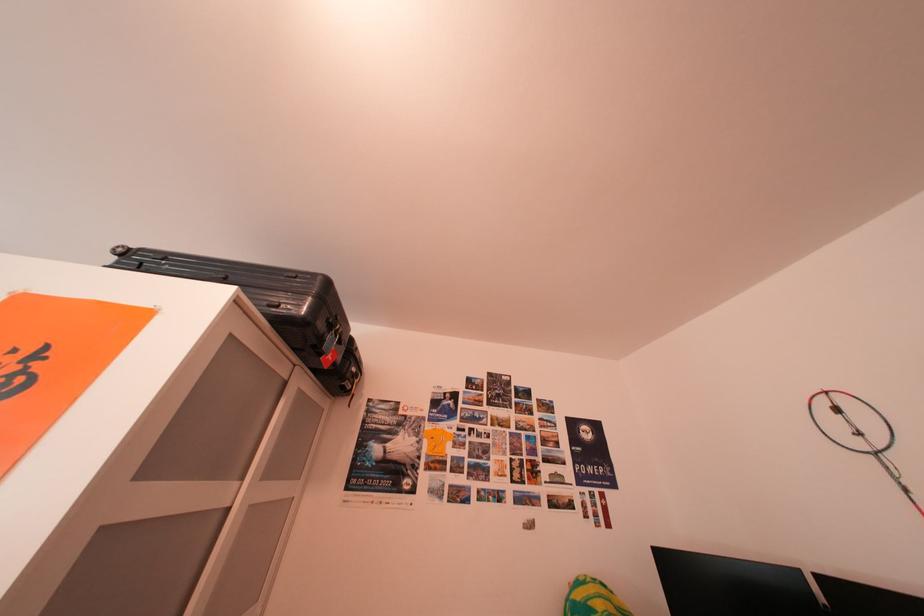
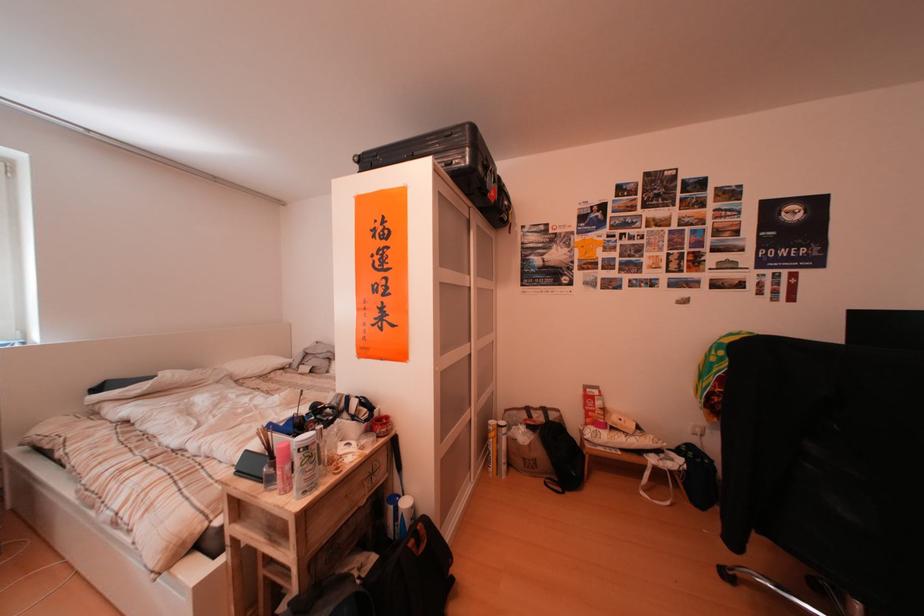
Locate, in the second image, the point that corresponds to (x=132, y=260) in the first image.

(371, 167)